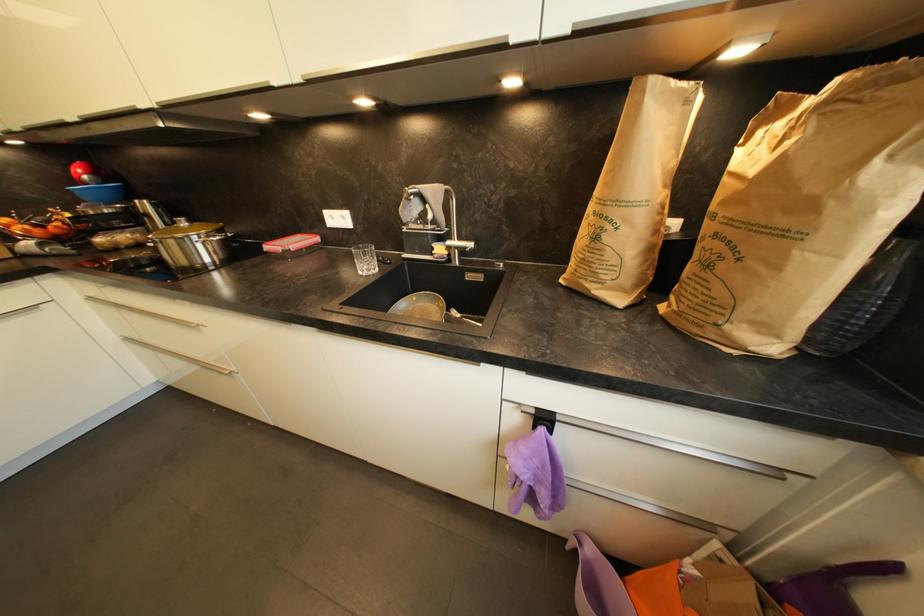
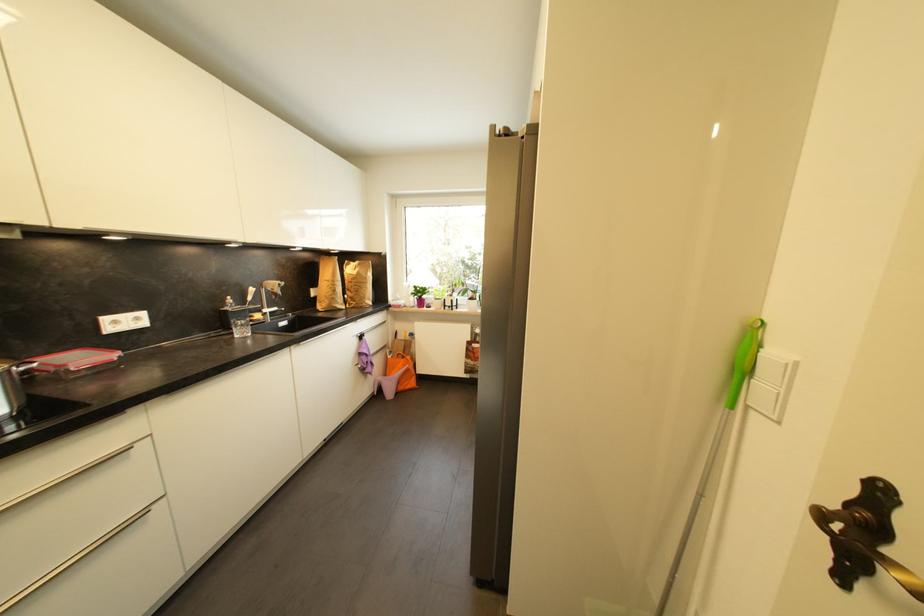
In the second image, find the point that corresponds to point (697, 569) in the first image.

(395, 359)